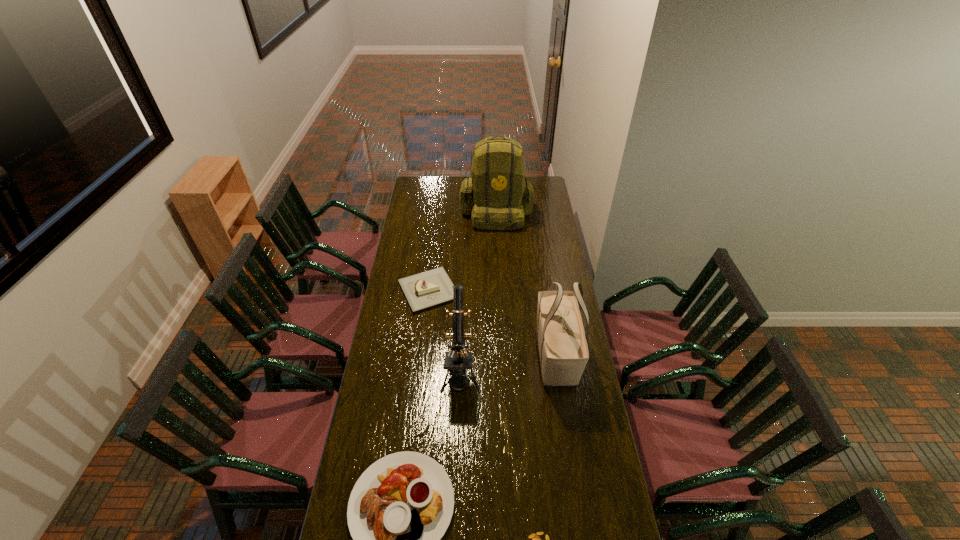
Where is `vacant area between the backpack and the second shortest object`? vacant area between the backpack and the second shortest object is located at coordinates (463, 251).

Where is `free space between the microscope and the shopping bag`? Image resolution: width=960 pixels, height=540 pixels. free space between the microscope and the shopping bag is located at coordinates (508, 367).

Choose which object is the second nearest neighbor to the cake. Please provide its 2D coordinates. Your answer should be formatted as a tuple, i.e. [(x, y)], where the tuple contains the x and y coordinates of a point satisfying the conditions above.

[(501, 194)]

Select which object is the fourth closest to the platter. Please provide its 2D coordinates. Your answer should be formatted as a tuple, i.e. [(x, y)], where the tuple contains the x and y coordinates of a point satisfying the conditions above.

[(426, 289)]